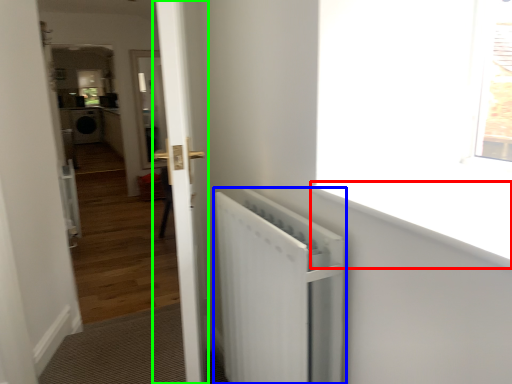
Question: Which object is positioned farthest from window sill (highlighted by a red box)? Select from radiator (highlighted by a blue box) and door (highlighted by a green box).

Choices:
 (A) radiator
 (B) door

Answer: (B)